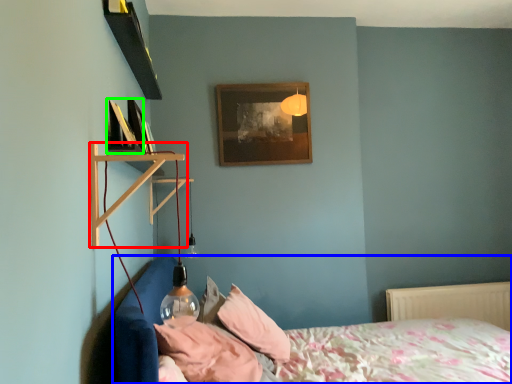
Question: Which object is the closest to the shelf (highlighted by a red box)? Choose among these: bed (highlighted by a blue box) or picture frame (highlighted by a green box).

Choices:
 (A) bed
 (B) picture frame

Answer: (B)